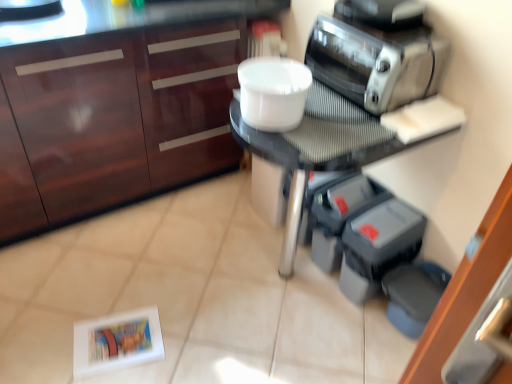
Question: From a real-world perspective, is metallic silver toaster at upper right on gray plastic containers at lower right, the 1th appliance when ordered from left to right?

Choices:
 (A) yes
 (B) no

Answer: (A)

Question: Considering the relative sizes of metallic silver toaster at upper right and gray plastic containers at lower right, marked as the second appliance in a right-to-left arrangement, in the image provided, is metallic silver toaster at upper right wider than gray plastic containers at lower right, marked as the second appliance in a right-to-left arrangement,?

Choices:
 (A) no
 (B) yes

Answer: (A)

Question: From a real-world perspective, is metallic silver toaster at upper right physically below gray plastic containers at lower right, the 1th appliance when ordered from left to right?

Choices:
 (A) no
 (B) yes

Answer: (A)

Question: Can you confirm if metallic silver toaster at upper right is shorter than gray plastic containers at lower right, the 1th appliance when ordered from left to right?

Choices:
 (A) yes
 (B) no

Answer: (A)

Question: Does metallic silver toaster at upper right appear on the right side of gray plastic containers at lower right, the 1th appliance when ordered from left to right?

Choices:
 (A) no
 (B) yes

Answer: (A)

Question: From a real-world perspective, is metallic silver toaster at upper right positioned above or below matte wood cabinetry at upper left?

Choices:
 (A) above
 (B) below

Answer: (A)

Question: In the image, is metallic silver toaster at upper right on the left side or the right side of matte wood cabinetry at upper left?

Choices:
 (A) left
 (B) right

Answer: (B)

Question: In terms of height, does metallic silver toaster at upper right look taller or shorter compared to matte wood cabinetry at upper left?

Choices:
 (A) tall
 (B) short

Answer: (B)

Question: From the image's perspective, is metallic silver toaster at upper right above or below matte wood cabinetry at upper left?

Choices:
 (A) above
 (B) below

Answer: (A)

Question: Considering the positions of matte black table at center and satin silver toaster at upper right in the image, is matte black table at center taller or shorter than satin silver toaster at upper right?

Choices:
 (A) tall
 (B) short

Answer: (A)

Question: Looking at the image, does matte black table at center seem bigger or smaller compared to satin silver toaster at upper right?

Choices:
 (A) big
 (B) small

Answer: (A)

Question: From a real-world perspective, is matte black table at center positioned above or below satin silver toaster at upper right?

Choices:
 (A) below
 (B) above

Answer: (A)

Question: Looking at their shapes, would you say matte black table at center is wider or thinner than satin silver toaster at upper right?

Choices:
 (A) thin
 (B) wide

Answer: (B)

Question: From a real-world perspective, relative to white plastic bowl at center, is gray rubber dumbbells at lower right, arranged as the 2th appliance when viewed from the left, vertically above or below?

Choices:
 (A) below
 (B) above

Answer: (A)

Question: In terms of width, does gray rubber dumbbells at lower right, which is the first appliance from right to left, look wider or thinner when compared to white plastic bowl at center?

Choices:
 (A) wide
 (B) thin

Answer: (A)